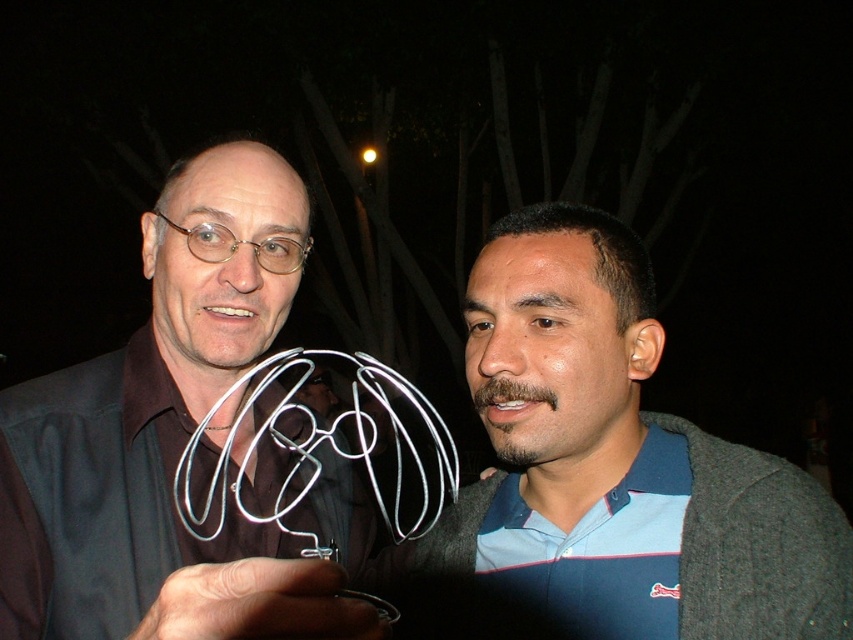
Question: Which object appears farthest from the camera in this image?

Choices:
 (A) blue fabric shirt at center
 (B) metallic wire sculpture at center

Answer: (A)

Question: Where is blue fabric shirt at center located in relation to metallic wire sculpture at center in the image?

Choices:
 (A) above
 (B) below

Answer: (A)

Question: Is blue fabric shirt at center to the right of metallic wire sculpture at center from the viewer's perspective?

Choices:
 (A) yes
 (B) no

Answer: (A)

Question: Which object appears farthest from the camera in this image?

Choices:
 (A) metallic wire sculpture at center
 (B) blue fabric shirt at center

Answer: (B)

Question: Does blue fabric shirt at center have a smaller size compared to metallic wire sculpture at center?

Choices:
 (A) no
 (B) yes

Answer: (B)